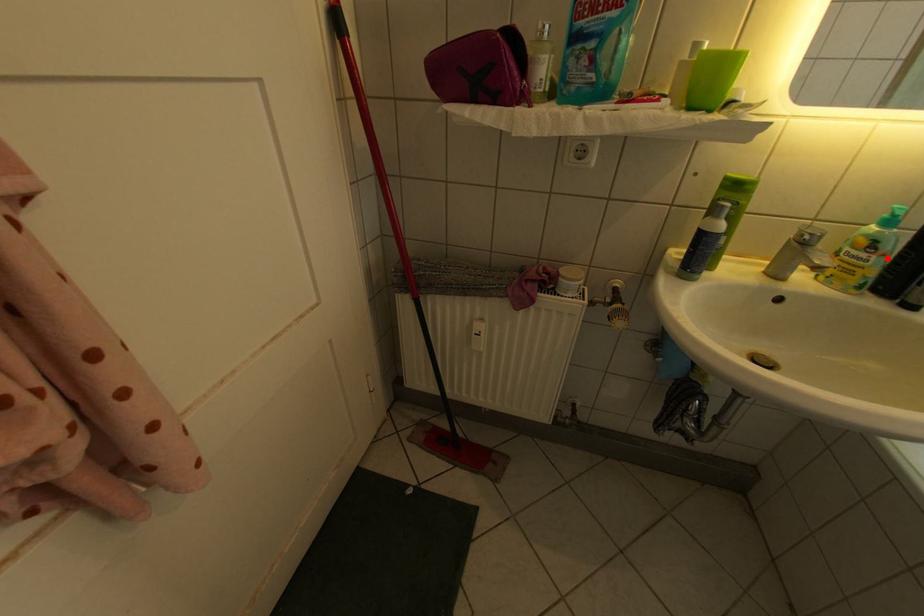
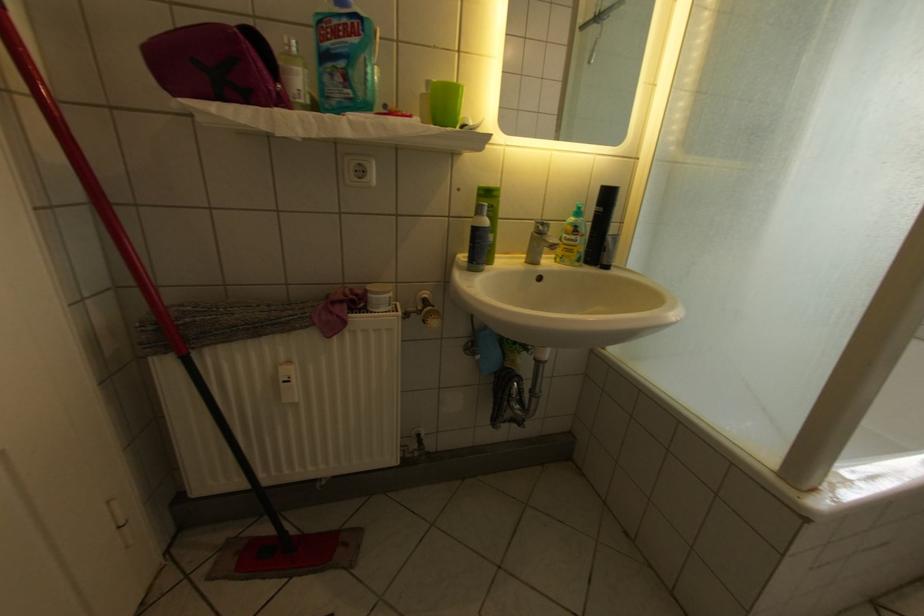
In the second image, find the point that corresponds to the highlighted location in the first image.

(590, 238)